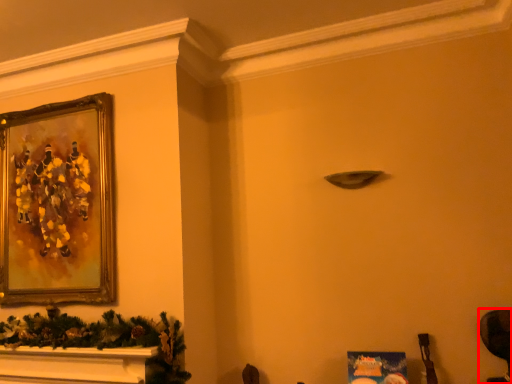
Question: In this image, where is swivel chair (annotated by the red box) located relative to picture frame?

Choices:
 (A) left
 (B) right

Answer: (B)